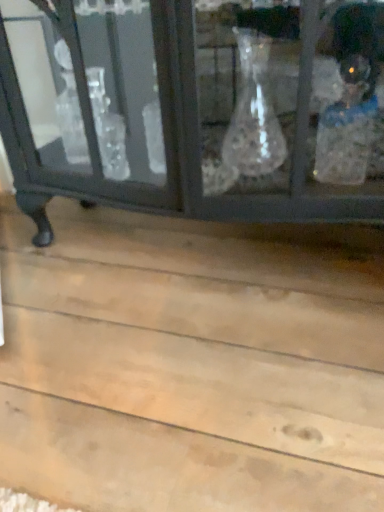
Question: Is point (77, 156) closer or farther from the camera than point (339, 463)?

Choices:
 (A) farther
 (B) closer

Answer: (A)

Question: In terms of height, does matte black cabinet at upper center look taller or shorter compared to natural wood plank at lower center?

Choices:
 (A) short
 (B) tall

Answer: (B)

Question: From the image's perspective, is matte black cabinet at upper center above or below natural wood plank at lower center?

Choices:
 (A) below
 (B) above

Answer: (B)

Question: Considering the positions of point (178, 420) and point (155, 204), is point (178, 420) closer or farther from the camera than point (155, 204)?

Choices:
 (A) farther
 (B) closer

Answer: (B)

Question: From their relative heights in the image, would you say natural wood plank at lower center is taller or shorter than matte black cabinet at upper center?

Choices:
 (A) short
 (B) tall

Answer: (A)

Question: From a real-world perspective, is natural wood plank at lower center above or below matte black cabinet at upper center?

Choices:
 (A) above
 (B) below

Answer: (B)

Question: Is natural wood plank at lower center wider or thinner than matte black cabinet at upper center?

Choices:
 (A) thin
 (B) wide

Answer: (B)